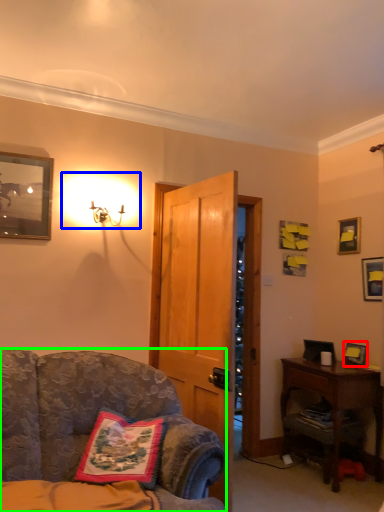
Question: Based on their relative distances, which object is nearer to picture frame (highlighted by a red box)? Choose from lighting (highlighted by a blue box) and chair (highlighted by a green box).

Choices:
 (A) lighting
 (B) chair

Answer: (B)